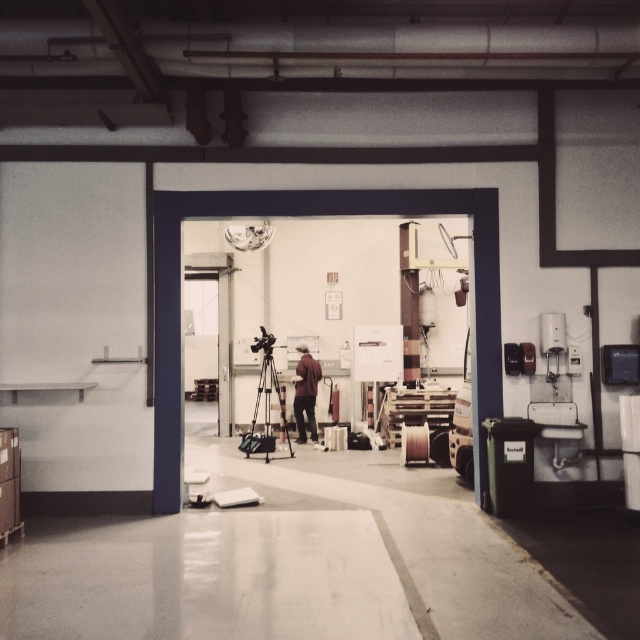
Question: Considering the relative positions of matte black tripod at center and dark brown leather jacket at center in the image provided, where is matte black tripod at center located with respect to dark brown leather jacket at center?

Choices:
 (A) right
 (B) left

Answer: (B)

Question: Can you confirm if matte black tripod at center is positioned to the right of dark brown leather jacket at center?

Choices:
 (A) no
 (B) yes

Answer: (A)

Question: Which object is closer to the camera taking this photo?

Choices:
 (A) dark brown leather jacket at center
 (B) matte black tripod at center

Answer: (B)

Question: Among these points, which one is nearest to the camera?

Choices:
 (A) (298, 365)
 (B) (272, 436)

Answer: (B)

Question: Observing the image, what is the correct spatial positioning of matte black tripod at center in reference to dark brown leather jacket at center?

Choices:
 (A) left
 (B) right

Answer: (A)

Question: Which point is closer to the camera taking this photo?

Choices:
 (A) (269, 374)
 (B) (308, 388)

Answer: (B)